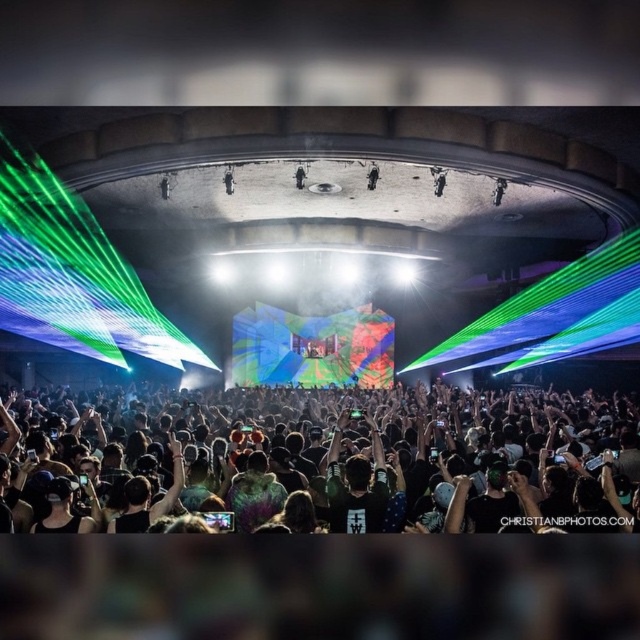
Who is more forward, (x=19, y=397) or (x=355, y=518)?

Point (x=355, y=518) is more forward.

Is point (321, 496) in front of point (380, 452)?

Yes, it is in front of point (380, 452).

Does point (288, 390) come behind point (358, 481)?

Yes.

Where is `dark hair at lower center`? dark hair at lower center is located at coordinates (348, 461).

Is dark green t-shirt at center below black matte person at center?

Yes, dark green t-shirt at center is below black matte person at center.

The height and width of the screenshot is (640, 640). I want to click on dark green t-shirt at center, so click(x=360, y=486).

The height and width of the screenshot is (640, 640). I want to click on dark green t-shirt at center, so click(360, 486).

Looking at this image, which is more to the right, dark green t-shirt at center or black matte person at upper center?

black matte person at upper center

Does dark green t-shirt at center come behind black matte person at upper center?

No, it is in front of black matte person at upper center.

Between point (355, 476) and point (372, 161), which one is positioned behind?

The point (372, 161) is more distant.

At what (x,y) coordinates should I click in order to perform the action: click on dark green t-shirt at center. Please return your answer as a coordinate pair (x, y). Looking at the image, I should click on (360, 486).